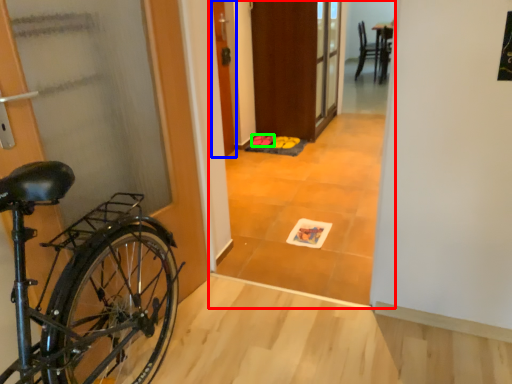
Question: Estimate the real-world distances between objects in this image. Which object is farther from corridor (highlighted by a red box), door (highlighted by a blue box) or footwear (highlighted by a green box)?

Choices:
 (A) door
 (B) footwear

Answer: (B)